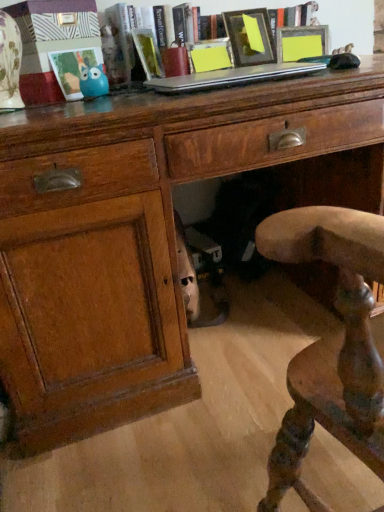
Question: Should I look upward or downward to see matte yellow picture frame at center, the second picture frame in the right-to-left sequence?

Choices:
 (A) down
 (B) up

Answer: (B)

Question: Can matte plastic picture frame at upper left, placed as the first picture frame when sorted from left to right, be found inside hardcover book at center, positioned as the 2th book in right-to-left order?

Choices:
 (A) no
 (B) yes

Answer: (A)

Question: Is hardcover book at center, positioned as the 2th book in right-to-left order, looking in the opposite direction of matte plastic picture frame at upper left, the 3th picture frame from the right?

Choices:
 (A) no
 (B) yes

Answer: (A)

Question: Is hardcover book at center, acting as the first book starting from the left, facing towards matte plastic picture frame at upper left, the 3th picture frame from the right?

Choices:
 (A) yes
 (B) no

Answer: (B)

Question: Are hardcover book at center, acting as the first book starting from the left, and matte plastic picture frame at upper left, placed as the first picture frame when sorted from left to right, located far from each other?

Choices:
 (A) yes
 (B) no

Answer: (B)

Question: From the image's perspective, is hardcover book at center, acting as the first book starting from the left, over matte plastic picture frame at upper left, the 3th picture frame from the right?

Choices:
 (A) yes
 (B) no

Answer: (A)

Question: Is hardcover book at center, positioned as the 2th book in right-to-left order, bigger than matte plastic picture frame at upper left, placed as the first picture frame when sorted from left to right?

Choices:
 (A) yes
 (B) no

Answer: (A)

Question: Is blue rubber toy at upper left in contact with matte yellow picture frame at center, which is the second picture frame from left to right?

Choices:
 (A) no
 (B) yes

Answer: (A)

Question: From the image's perspective, is blue rubber toy at upper left beneath matte yellow picture frame at center, the second picture frame in the right-to-left sequence?

Choices:
 (A) no
 (B) yes

Answer: (B)

Question: Is blue rubber toy at upper left closer to camera compared to matte yellow picture frame at center, which is the second picture frame from left to right?

Choices:
 (A) yes
 (B) no

Answer: (A)

Question: Would you say blue rubber toy at upper left is a long distance from matte yellow picture frame at center, the second picture frame in the right-to-left sequence?

Choices:
 (A) yes
 (B) no

Answer: (B)

Question: From a real-world perspective, does blue rubber toy at upper left sit lower than matte yellow picture frame at center, the second picture frame in the right-to-left sequence?

Choices:
 (A) yes
 (B) no

Answer: (A)

Question: Is matte yellow picture frame at center, the second picture frame in the right-to-left sequence, a part of blue rubber toy at upper left?

Choices:
 (A) no
 (B) yes

Answer: (A)

Question: Is matte black picture frame at upper center, acting as the first picture frame starting from the right, turned away from silver metallic laptop at upper center?

Choices:
 (A) no
 (B) yes

Answer: (A)